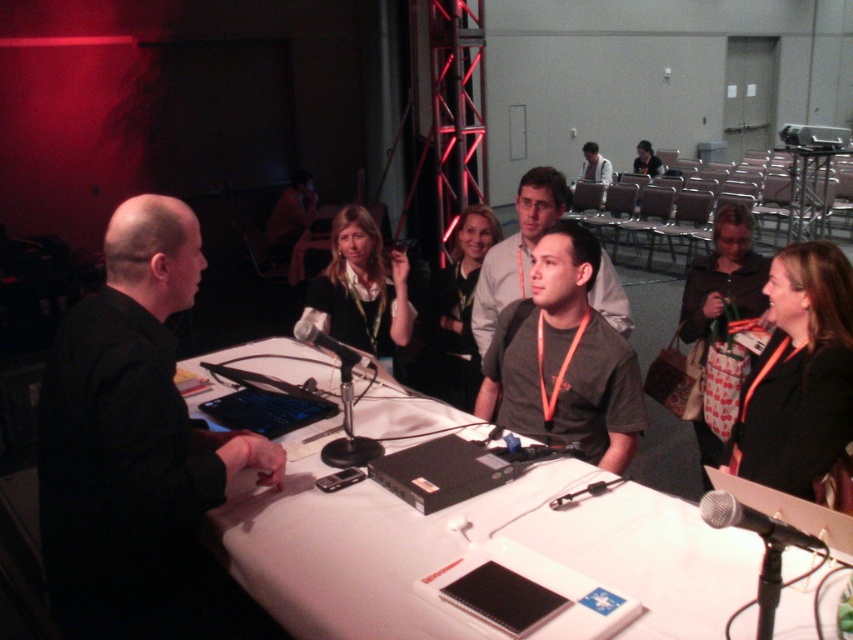
You are organizing a photo shoot and need to ensure that the matte black shirt at center and the light gray shirt at upper center are visible in the frame. Given their sizes, which shirt might require you to adjust the camera angle to ensure it fits within the shot?

The matte black shirt at center is wider than the light gray shirt at upper center, so the matte black shirt at center may require adjusting the camera angle to ensure it fits within the shot.

You are organizing a photo shoot and need to ensure that the matte black shirt at center and the light gray shirt at upper center are visible in the frame. Given their sizes, which shirt should you focus on to ensure both are in the shot?

The matte black shirt at center is larger than the light gray shirt at upper center, so focusing on the matte black shirt at center would help ensure both shirts are visible in the frame.

You are at a conference and need to find the gray fabric shirt at center and the light gray shirt at upper center. Which one is positioned to the left of the other?

The gray fabric shirt at center is to the left of light gray shirt at upper center.